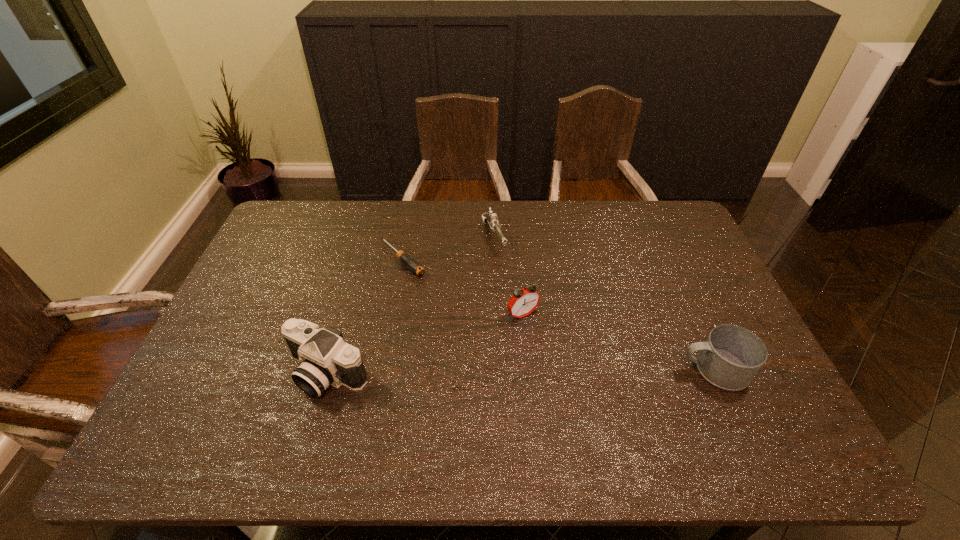
Locate an element on the screen. This screenshot has width=960, height=540. camera is located at coordinates (325, 358).

In order to click on the rightmost object in this screenshot , I will do `click(731, 356)`.

Find the location of a particular element. This screenshot has width=960, height=540. the shortest object is located at coordinates (414, 266).

Where is `alarm clock`? The width and height of the screenshot is (960, 540). alarm clock is located at coordinates (524, 301).

At what (x,y) coordinates should I click in order to perform the action: click on gun. Please return your answer as a coordinate pair (x, y). Image resolution: width=960 pixels, height=540 pixels. Looking at the image, I should click on (492, 219).

This screenshot has height=540, width=960. I want to click on vacant area situated on the back of the camera, so click(x=349, y=298).

Locate an element on the screen. Image resolution: width=960 pixels, height=540 pixels. free location located on the side of the rightmost object with the handle is located at coordinates (657, 369).

The width and height of the screenshot is (960, 540). I want to click on vacant area situated 0.220m on the side of the rightmost object with the handle, so click(x=595, y=369).

The width and height of the screenshot is (960, 540). I want to click on vacant region located 0.360m on the side of the rightmost object with the handle, so click(x=541, y=369).

The image size is (960, 540). In order to click on vacant space located at the tip of the shortest object in this screenshot , I will do `click(440, 294)`.